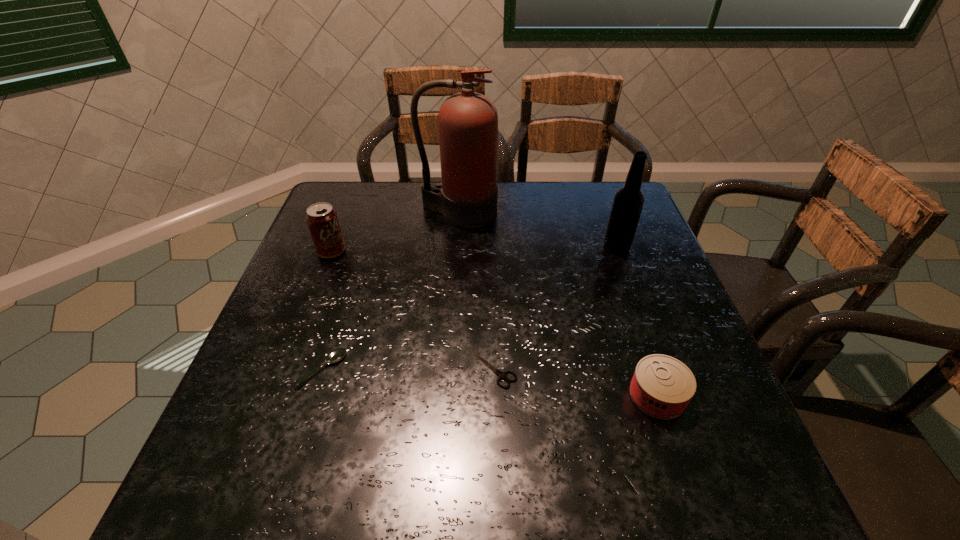
Where is `blank space located on the back of the can`? blank space located on the back of the can is located at coordinates coord(619,280).

Locate an element on the screen. vacant space positioned on the right of the second shortest object is located at coordinates (461, 369).

Where is `blank area located on the left of the shears`? The height and width of the screenshot is (540, 960). blank area located on the left of the shears is located at coordinates (387, 369).

The image size is (960, 540). I want to click on object at the far edge, so click(x=468, y=121).

Identify the location of soda can that is at the left edge. The height and width of the screenshot is (540, 960). (322, 220).

The width and height of the screenshot is (960, 540). I want to click on soupspoon present at the left edge, so click(336, 355).

At what (x,y) coordinates should I click in order to perform the action: click on beer bottle located at the right edge. Please return your answer as a coordinate pair (x, y). This screenshot has height=540, width=960. Looking at the image, I should click on (628, 202).

This screenshot has width=960, height=540. Identify the location of can positioned at the right edge. (662, 386).

The width and height of the screenshot is (960, 540). In the image, there is a desktop. What are the coordinates of `vacant space at the far edge` in the screenshot? It's located at (424, 183).

In the image, there is a desktop. Identify the location of vacant space at the near edge. (659, 504).